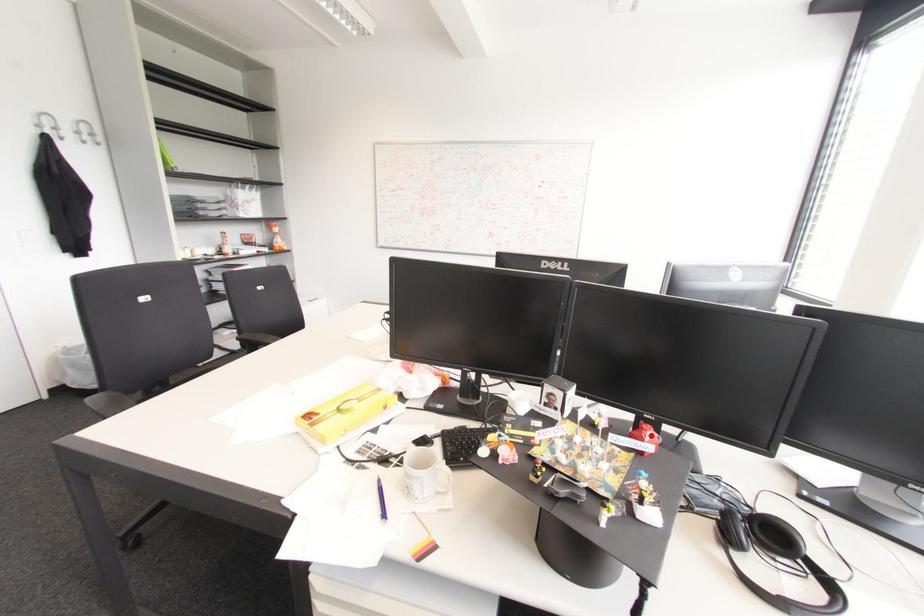
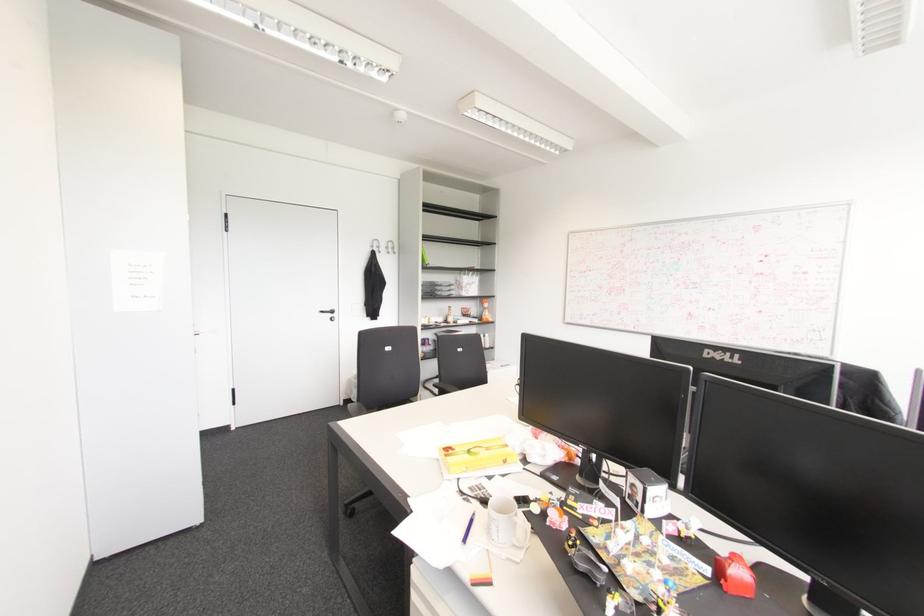
In the second image, find the point that corresponds to the highlighted location in the first image.

(740, 570)